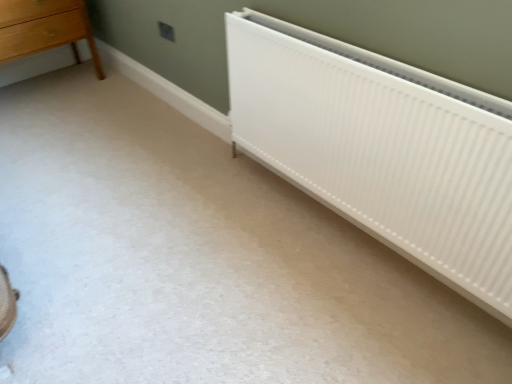
Identify the location of light brown wooden chest of drawers at upper left. (44, 28).

What is the approximate height of light brown wooden chest of drawers at upper left?

light brown wooden chest of drawers at upper left is 63.75 centimeters in height.

The image size is (512, 384). What do you see at coordinates (44, 28) in the screenshot?
I see `light brown wooden chest of drawers at upper left` at bounding box center [44, 28].

Describe the element at coordinates (381, 149) in the screenshot. I see `white ribbed radiator at lower right` at that location.

You are a GUI agent. You are given a task and a screenshot of the screen. Output one action in this format:
    pyautogui.click(x=<x>, y=<y>)
    Task: Click on the white ribbed radiator at lower right
    The height and width of the screenshot is (384, 512).
    Given the screenshot: What is the action you would take?
    pyautogui.click(x=381, y=149)

What is the approximate height of white ribbed radiator at lower right?

white ribbed radiator at lower right is 75.58 centimeters tall.

At what (x,y) coordinates should I click in order to perform the action: click on light brown wooden chest of drawers at upper left. Please return your answer as a coordinate pair (x, y). The width and height of the screenshot is (512, 384). Looking at the image, I should click on (44, 28).

Considering the relative positions of light brown wooden chest of drawers at upper left and white ribbed radiator at lower right in the image provided, is light brown wooden chest of drawers at upper left to the left of white ribbed radiator at lower right from the viewer's perspective?

Yes, light brown wooden chest of drawers at upper left is to the left of white ribbed radiator at lower right.

Is light brown wooden chest of drawers at upper left behind white ribbed radiator at lower right?

Yes, the depth of light brown wooden chest of drawers at upper left is greater than that of white ribbed radiator at lower right.

Between point (71, 19) and point (467, 295), which one is positioned behind?

The point (71, 19) is farther from the camera.

From the image's perspective, is light brown wooden chest of drawers at upper left above white ribbed radiator at lower right?

Yes, from the image's perspective, light brown wooden chest of drawers at upper left is over white ribbed radiator at lower right.

From a real-world perspective, between light brown wooden chest of drawers at upper left and white ribbed radiator at lower right, who is vertically lower?

From a 3D spatial view, light brown wooden chest of drawers at upper left is below.

Can you confirm if light brown wooden chest of drawers at upper left is wider than white ribbed radiator at lower right?

Yes, light brown wooden chest of drawers at upper left is wider than white ribbed radiator at lower right.

Considering the sizes of light brown wooden chest of drawers at upper left and white ribbed radiator at lower right in the image, is light brown wooden chest of drawers at upper left taller or shorter than white ribbed radiator at lower right?

In the image, light brown wooden chest of drawers at upper left appears to be shorter than white ribbed radiator at lower right.

Considering the sizes of objects light brown wooden chest of drawers at upper left and white ribbed radiator at lower right in the image provided, who is smaller, light brown wooden chest of drawers at upper left or white ribbed radiator at lower right?

With smaller size is white ribbed radiator at lower right.

Can we say light brown wooden chest of drawers at upper left lies outside white ribbed radiator at lower right?

light brown wooden chest of drawers at upper left is positioned outside white ribbed radiator at lower right.

In the scene shown: Is the surface of light brown wooden chest of drawers at upper left in direct contact with white ribbed radiator at lower right?

No, light brown wooden chest of drawers at upper left is not next to white ribbed radiator at lower right.

Is light brown wooden chest of drawers at upper left oriented towards white ribbed radiator at lower right?

Yes, light brown wooden chest of drawers at upper left is oriented towards white ribbed radiator at lower right.

How different are the orientations of light brown wooden chest of drawers at upper left and white ribbed radiator at lower right in degrees?

They differ by 91 degrees in their facing directions.

In the image, there is a white ribbed radiator at lower right. Find the location of `the chest of drawers above it (from the image's perspective)`. the chest of drawers above it (from the image's perspective) is located at coordinates [x=44, y=28].

Considering the positions of objects white ribbed radiator at lower right and light brown wooden chest of drawers at upper left in the image provided, who is more to the left, white ribbed radiator at lower right or light brown wooden chest of drawers at upper left?

light brown wooden chest of drawers at upper left is more to the left.

Which object is more forward, white ribbed radiator at lower right or light brown wooden chest of drawers at upper left?

Positioned in front is white ribbed radiator at lower right.

Considering the positions of point (343, 87) and point (99, 78), is point (343, 87) closer or farther from the camera than point (99, 78)?

Clearly, point (343, 87) is closer to the camera than point (99, 78).

From the image's perspective, is white ribbed radiator at lower right above light brown wooden chest of drawers at upper left?

No, from the image's perspective, white ribbed radiator at lower right is not over light brown wooden chest of drawers at upper left.

From a real-world perspective, is white ribbed radiator at lower right located higher than light brown wooden chest of drawers at upper left?

Yes.

In terms of width, does white ribbed radiator at lower right look wider or thinner when compared to light brown wooden chest of drawers at upper left?

white ribbed radiator at lower right is thinner than light brown wooden chest of drawers at upper left.

Between white ribbed radiator at lower right and light brown wooden chest of drawers at upper left, which one has less height?

With less height is light brown wooden chest of drawers at upper left.

In the scene shown: Considering the sizes of objects white ribbed radiator at lower right and light brown wooden chest of drawers at upper left in the image provided, who is smaller, white ribbed radiator at lower right or light brown wooden chest of drawers at upper left?

white ribbed radiator at lower right.

From the picture: Is white ribbed radiator at lower right inside or outside of light brown wooden chest of drawers at upper left?

white ribbed radiator at lower right lies outside light brown wooden chest of drawers at upper left.

Would you say white ribbed radiator at lower right is a long distance from light brown wooden chest of drawers at upper left?

Yes, white ribbed radiator at lower right is far from light brown wooden chest of drawers at upper left.

Is white ribbed radiator at lower right looking in the opposite direction of light brown wooden chest of drawers at upper left?

white ribbed radiator at lower right does not have its back to light brown wooden chest of drawers at upper left.

Identify the location of the chest of drawers behind the white ribbed radiator at lower right. (44, 28).

This screenshot has height=384, width=512. What are the coordinates of `chest of drawers that is on the left side of white ribbed radiator at lower right` in the screenshot? It's located at (44, 28).

Identify the location of radiator below the light brown wooden chest of drawers at upper left (from the image's perspective). (381, 149).